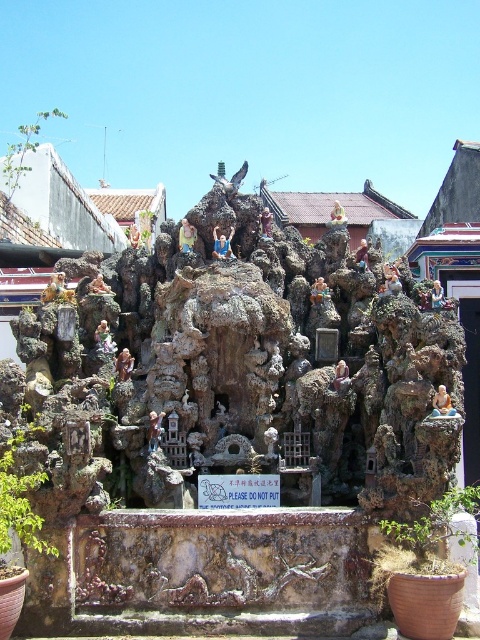
You are an archaeologist examining the sculpture and want to document the two points on it. Which of the two points, point (99, 300) or point (187, 248), is closer to your camera lens?

Point (99, 300) is closer to the camera lens than point (187, 248).